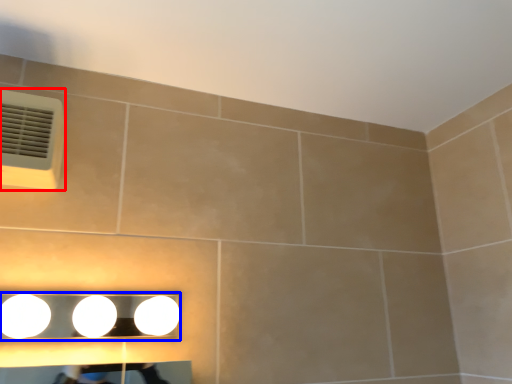
Question: Which point is further to the camera, air conditioning (highlighted by a red box) or fixture (highlighted by a blue box)?

Choices:
 (A) air conditioning
 (B) fixture

Answer: (A)